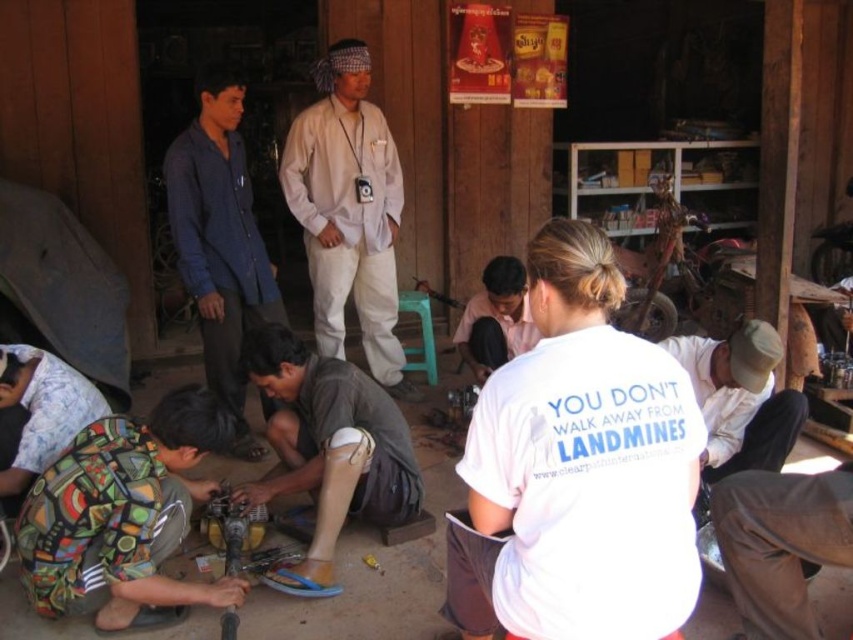
Can you confirm if brown fabric prosthetic leg at lower center is wider than printed fabric pants at lower left?

Yes, brown fabric prosthetic leg at lower center is wider than printed fabric pants at lower left.

Which is more to the left, brown fabric prosthetic leg at lower center or printed fabric pants at lower left?

From the viewer's perspective, printed fabric pants at lower left appears more on the left side.

Describe the element at coordinates (328, 449) in the screenshot. The height and width of the screenshot is (640, 853). I see `brown fabric prosthetic leg at lower center` at that location.

Locate an element on the screen. brown fabric prosthetic leg at lower center is located at coordinates (328, 449).

Does blue cotton shirt at upper left have a greater height compared to dark gray fabric shirt at center?

Indeed, blue cotton shirt at upper left has a greater height compared to dark gray fabric shirt at center.

What are the coordinates of `blue cotton shirt at upper left` in the screenshot? It's located at (219, 240).

Can you confirm if white cotton shirt at center is thinner than brown fabric prosthetic leg at lower center?

Incorrect, white cotton shirt at center's width is not less than brown fabric prosthetic leg at lower center's.

Who is taller, white cotton shirt at center or brown fabric prosthetic leg at lower center?

Standing taller between the two is white cotton shirt at center.

Is point (306, 109) positioned behind point (383, 420)?

Yes.

You are a GUI agent. You are given a task and a screenshot of the screen. Output one action in this format:
    pyautogui.click(x=<x>, y=<y>)
    Task: Click on the white cotton shirt at center
    
    Given the screenshot: What is the action you would take?
    pyautogui.click(x=347, y=211)